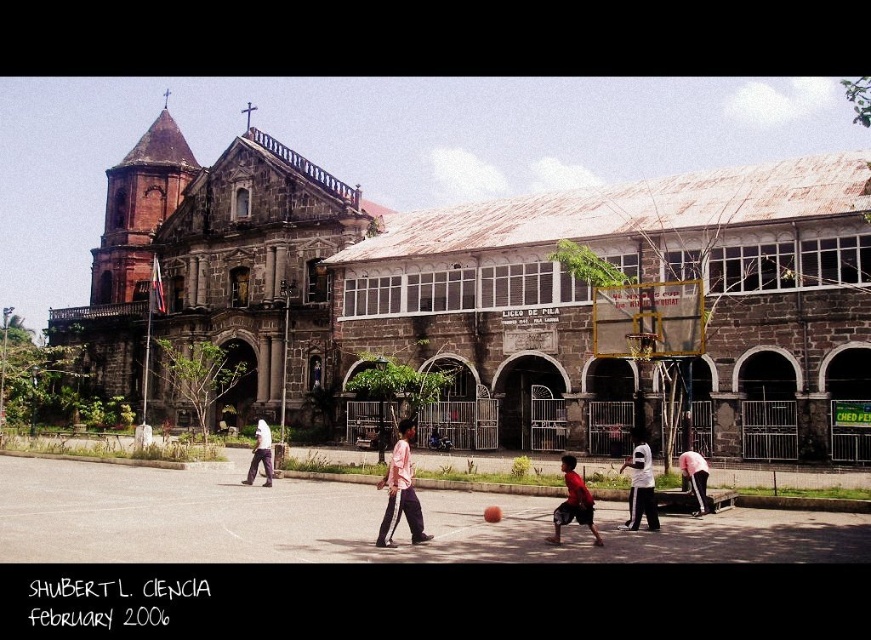
You are a photographer trying to capture a shot of the basketball game happening in front of the historic stone building. You notice the light brown pants at center and the orange matte basketball at center in your frame. Which object should you focus on if you want to ensure the wider subject is in sharp focus?

You should focus on the light brown pants at center because its width is larger than the orange matte basketball at center, making it the wider subject.

You are standing at the center of the basketball court in front of the historic stone building. There is a point marked at coordinates (694, 477). Which object from the list below is located at that point? The options are the pink fabric shirt at lower right and the basketball hoop on the right side of the frame.

The pink fabric shirt at lower right is located at point (694, 477).

You are a photographer standing at the entrance of the historic stone building. You want to capture a photo that includes both the pink fabric shirt at lower right and the orange matte basketball at center. Given that your camera has a maximum focus range of 10 meters, will you be able to take the photo without moving your position?

The pink fabric shirt at lower right and orange matte basketball at center are 10.32 meters apart from each other. Since the distance between them exceeds the camera maximum focus range of 10 meters, you won